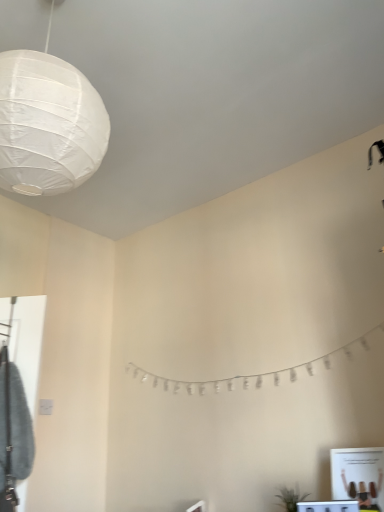
Question: Is white glossy vanity at lower right facing towards white paper garland at center?

Choices:
 (A) no
 (B) yes

Answer: (A)

Question: Is white glossy vanity at lower right facing away from white paper garland at center?

Choices:
 (A) no
 (B) yes

Answer: (A)

Question: From the image's perspective, is white glossy vanity at lower right located beneath white paper garland at center?

Choices:
 (A) no
 (B) yes

Answer: (B)

Question: Can you confirm if white glossy vanity at lower right is thinner than white paper garland at center?

Choices:
 (A) no
 (B) yes

Answer: (A)

Question: Is white glossy vanity at lower right bigger than white paper garland at center?

Choices:
 (A) no
 (B) yes

Answer: (A)

Question: In the image, is white glossy vanity at lower right on the left side or the right side of white paper lantern at upper left?

Choices:
 (A) left
 (B) right

Answer: (B)

Question: Looking at the image, does white glossy vanity at lower right seem bigger or smaller compared to white paper lantern at upper left?

Choices:
 (A) small
 (B) big

Answer: (A)

Question: Is white glossy vanity at lower right situated inside white paper lantern at upper left or outside?

Choices:
 (A) outside
 (B) inside

Answer: (A)

Question: From a real-world perspective, relative to white paper lantern at upper left, is white glossy vanity at lower right vertically above or below?

Choices:
 (A) above
 (B) below

Answer: (B)

Question: Considering their positions, is green matte plant at lower right located in front of or behind white paper lantern at upper left?

Choices:
 (A) behind
 (B) front

Answer: (A)

Question: Based on their sizes in the image, would you say green matte plant at lower right is bigger or smaller than white paper lantern at upper left?

Choices:
 (A) big
 (B) small

Answer: (B)

Question: Visually, is green matte plant at lower right positioned to the left or to the right of white paper lantern at upper left?

Choices:
 (A) left
 (B) right

Answer: (B)

Question: From the image's perspective, is green matte plant at lower right positioned above or below white paper lantern at upper left?

Choices:
 (A) below
 (B) above

Answer: (A)

Question: In terms of height, does green matte plant at lower right look taller or shorter compared to white glossy vanity at lower right?

Choices:
 (A) tall
 (B) short

Answer: (A)

Question: Is point (291, 500) closer or farther from the camera than point (324, 508)?

Choices:
 (A) farther
 (B) closer

Answer: (A)